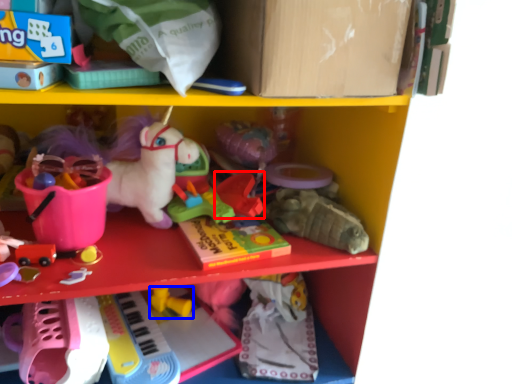
Question: Which of the following is the farthest to the observer, toy (highlighted by a red box) or toy (highlighted by a blue box)?

Choices:
 (A) toy
 (B) toy

Answer: (B)